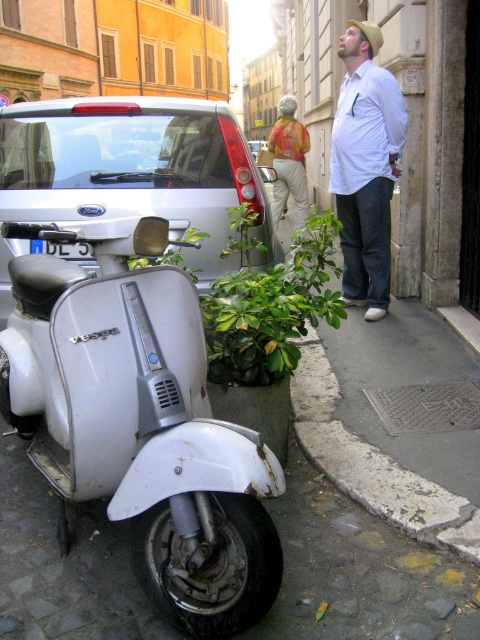
What are the coordinates of the silver metallic scooter at left?

The silver metallic scooter at left is located at coordinates point (135, 170).

In the scene shown: You are standing on the cobblestone street in front of the white Vespa scooter and want to determine which of the two points, point (348,166) or point (81,259), is closer to you. Based on the scene description, which point is nearer?

Point (348,166) is closer to you because it is further to the viewer than point (81,259).